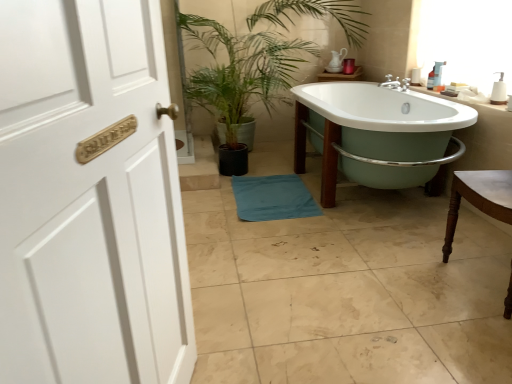
Question: Is brown wooden chair at right bigger than blue fabric bath towel at center?

Choices:
 (A) yes
 (B) no

Answer: (A)

Question: Is brown wooden chair at right oriented towards blue fabric bath towel at center?

Choices:
 (A) no
 (B) yes

Answer: (A)

Question: Is there a large distance between brown wooden chair at right and blue fabric bath towel at center?

Choices:
 (A) no
 (B) yes

Answer: (B)

Question: Can you confirm if brown wooden chair at right is positioned to the right of blue fabric bath towel at center?

Choices:
 (A) yes
 (B) no

Answer: (A)

Question: Is brown wooden chair at right taller than blue fabric bath towel at center?

Choices:
 (A) no
 (B) yes

Answer: (B)

Question: Is brown wooden chair at right shorter than blue fabric bath towel at center?

Choices:
 (A) yes
 (B) no

Answer: (B)

Question: Is white ceramic sink at upper right surrounded by white porcelain bathtub at center?

Choices:
 (A) no
 (B) yes

Answer: (A)

Question: Considering the relative positions of white porcelain bathtub at center and white ceramic sink at upper right in the image provided, is white porcelain bathtub at center behind white ceramic sink at upper right?

Choices:
 (A) no
 (B) yes

Answer: (A)

Question: From the image's perspective, is white porcelain bathtub at center under white ceramic sink at upper right?

Choices:
 (A) no
 (B) yes

Answer: (B)

Question: Is white porcelain bathtub at center far away from white ceramic sink at upper right?

Choices:
 (A) no
 (B) yes

Answer: (A)

Question: Is white porcelain bathtub at center directly adjacent to white ceramic sink at upper right?

Choices:
 (A) no
 (B) yes

Answer: (A)

Question: Is white porcelain bathtub at center taller than white ceramic sink at upper right?

Choices:
 (A) yes
 (B) no

Answer: (A)

Question: Is white ceramic sink at upper right in front of brown wooden chair at right?

Choices:
 (A) no
 (B) yes

Answer: (A)